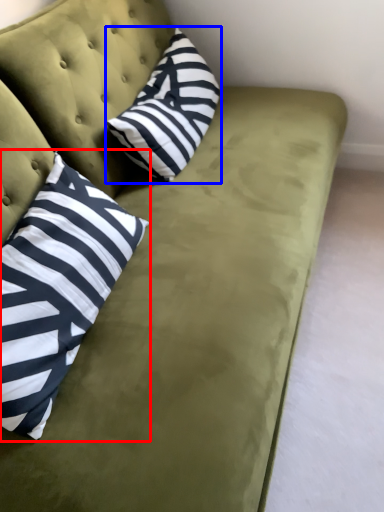
Question: Which object is further to the camera taking this photo, pillow (highlighted by a red box) or pillow (highlighted by a blue box)?

Choices:
 (A) pillow
 (B) pillow

Answer: (B)